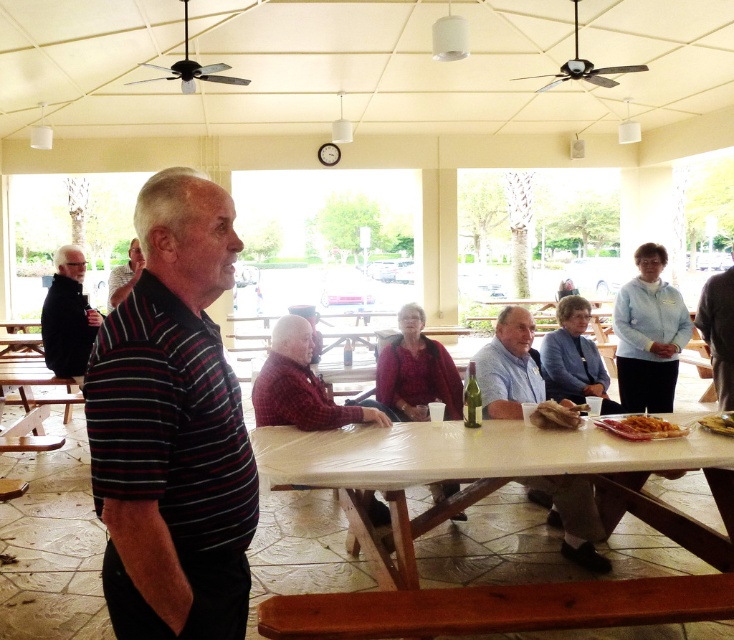
You are standing at the center of the pavilion and want to find the striped cotton shirt at left. In which direction should you look to see it?

The striped cotton shirt at left is located at point 0.669 on the x axis and 0.236 on the y axis. Since the x coordinate is greater than 0.5, it is to the right of the center. The y coordinate is below 0.5, so it is lower in the image. Therefore, you should look to the right and downward from the center to locate the striped cotton shirt at left.

You are standing at the entrance of the pavilion and want to hand a menu to the person wearing the black matte jacket at left and also place a basket of bread near the golden crispy bread at lower right. Which task should you perform first based on their positions?

You should hand the menu to the black matte jacket at left first because it is closer to you than the golden crispy bread at lower right, which is further away.

You are standing at the entrance of the pavilion and see two points marked in the scene. The first point is labeled as point (120,353) and the second is point (617,435). Which point is closer to you?

Point (120,353) is in front of point (617,435), so it is closer to you.